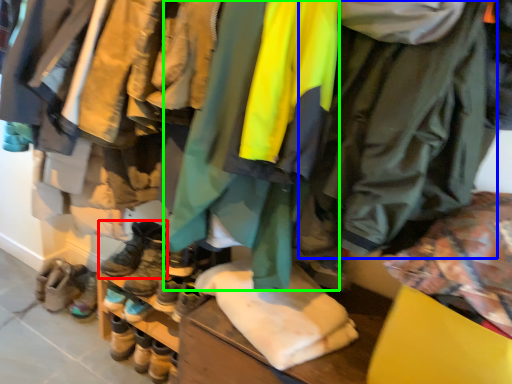
Question: Considering the real-world distances, which object is farthest from footwear (highlighted by a red box)? jacket (highlighted by a blue box) or jacket (highlighted by a green box)?

Choices:
 (A) jacket
 (B) jacket

Answer: (A)